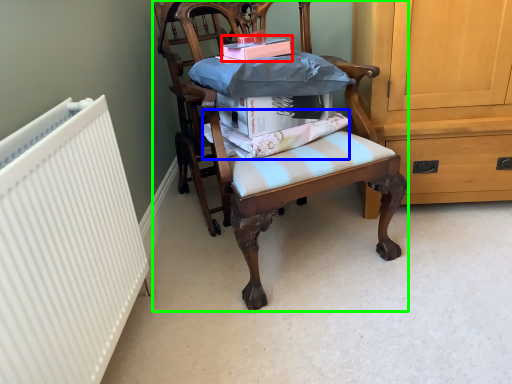
Question: Which object is positioned farthest from book (highlighted by a red box)? Select from fabric (highlighted by a blue box) and chair (highlighted by a green box).

Choices:
 (A) fabric
 (B) chair

Answer: (B)